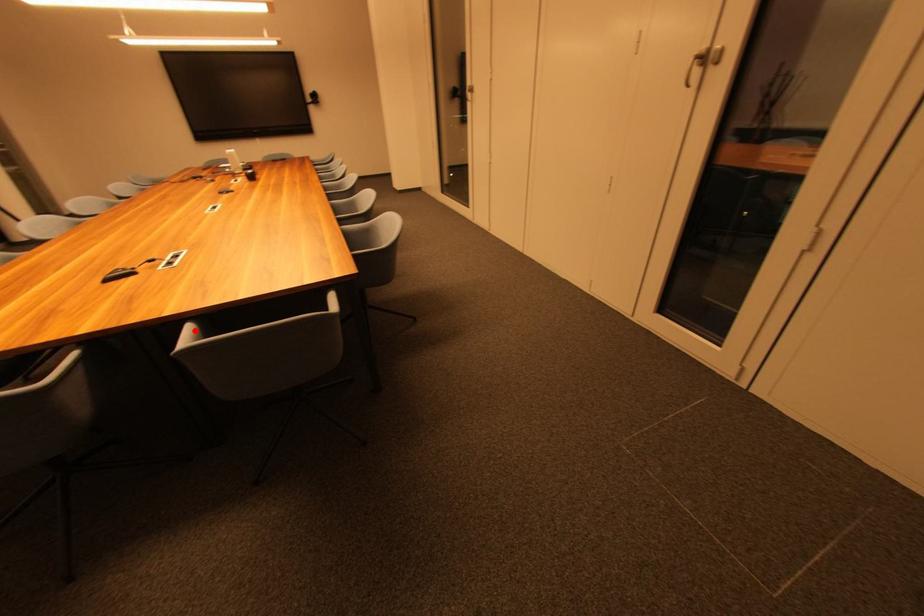
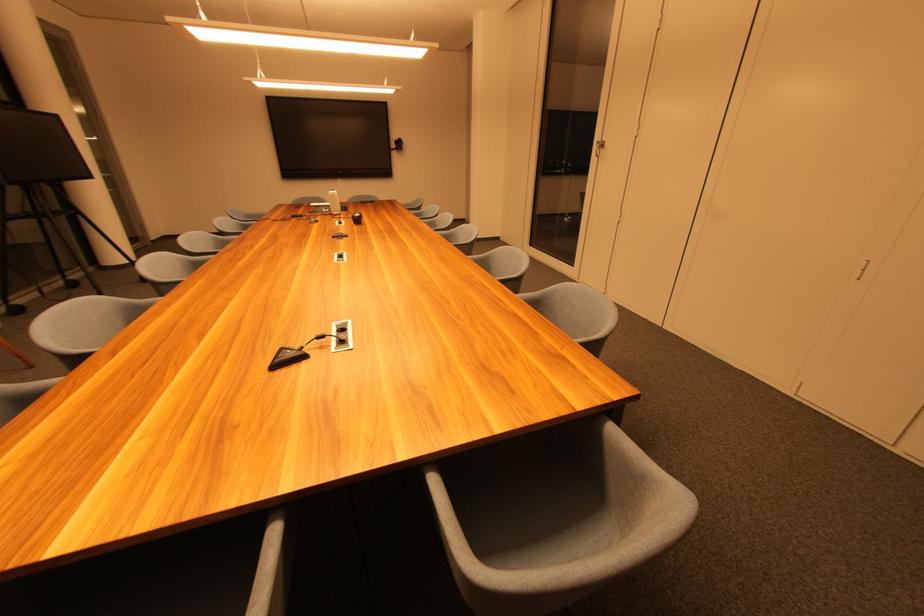
Question: I am providing you with two images of the same scene from different viewpoints. A red point is marked on the first image. At the location where the point appears in image 1, is it still visible in image 2?

Choices:
 (A) Yes
 (B) No

Answer: (A)